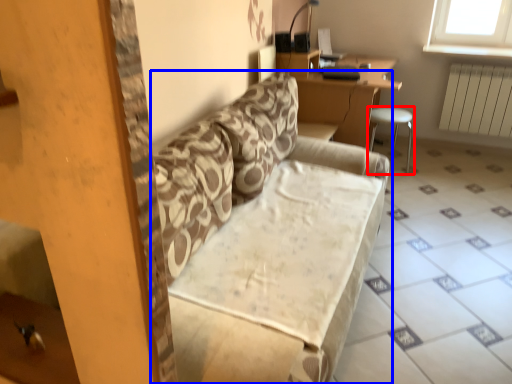
Question: Which object appears farthest to the camera in this image, furniture (highlighted by a red box) or studio couch (highlighted by a blue box)?

Choices:
 (A) furniture
 (B) studio couch

Answer: (A)